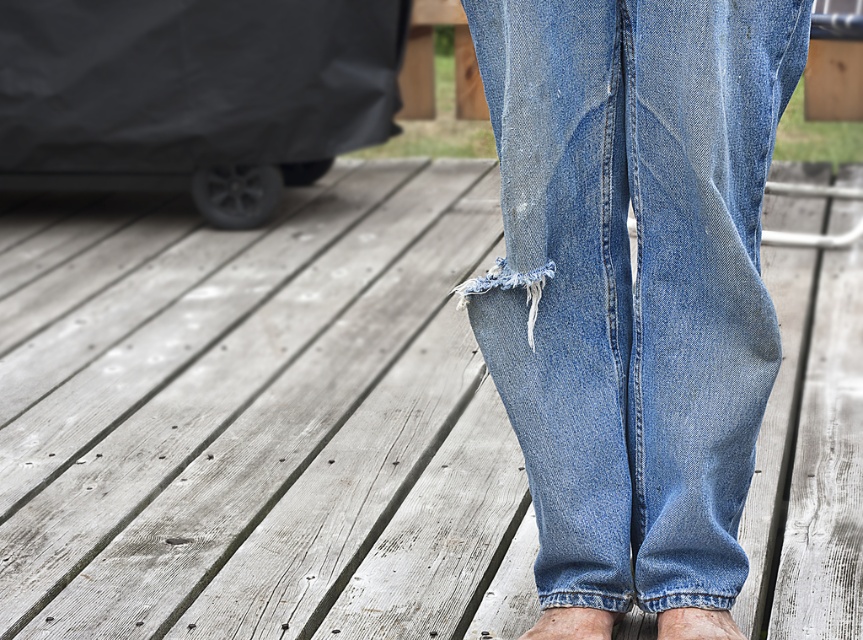
Question: In this image, where is blue denim foot at lower center located relative to light brown skin at lower center?

Choices:
 (A) right
 (B) left

Answer: (B)

Question: Can you confirm if denim at center is positioned below light brown skin at lower center?

Choices:
 (A) yes
 (B) no

Answer: (B)

Question: Which point is closer to the camera taking this photo?

Choices:
 (A) (665, 618)
 (B) (599, 614)
 (C) (599, 280)

Answer: (C)

Question: Can you confirm if denim at center is positioned to the left of light brown skin at lower center?

Choices:
 (A) no
 (B) yes

Answer: (B)

Question: Which point appears closest to the camera in this image?

Choices:
 (A) (597, 182)
 (B) (550, 611)
 (C) (690, 627)

Answer: (A)

Question: Which object is farther from the camera taking this photo?

Choices:
 (A) blue denim foot at lower center
 (B) light brown skin at lower center

Answer: (A)